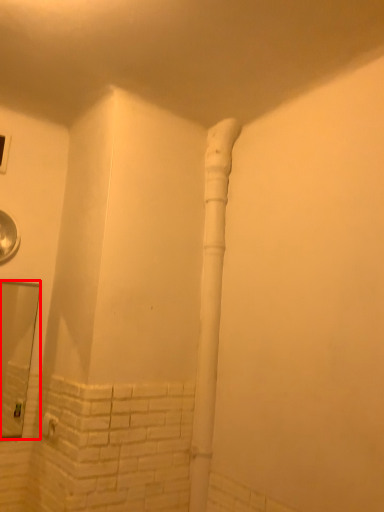
Question: From the image's perspective, where is mirror (annotated by the red box) located in relation to water pipe in the image?

Choices:
 (A) above
 (B) below

Answer: (B)